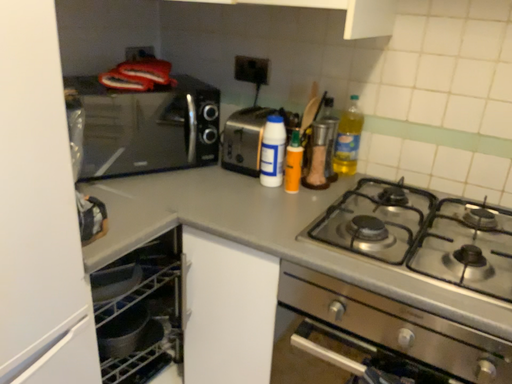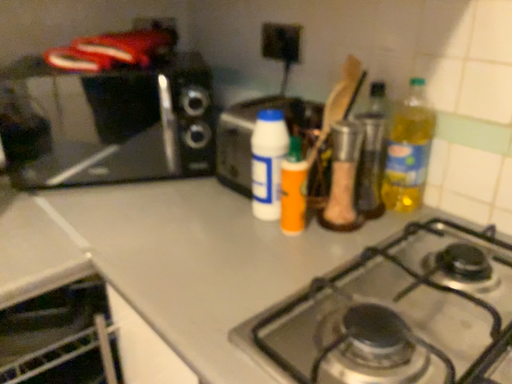
Question: Which way did the camera rotate in the video?

Choices:
 (A) rotated left
 (B) rotated right

Answer: (A)